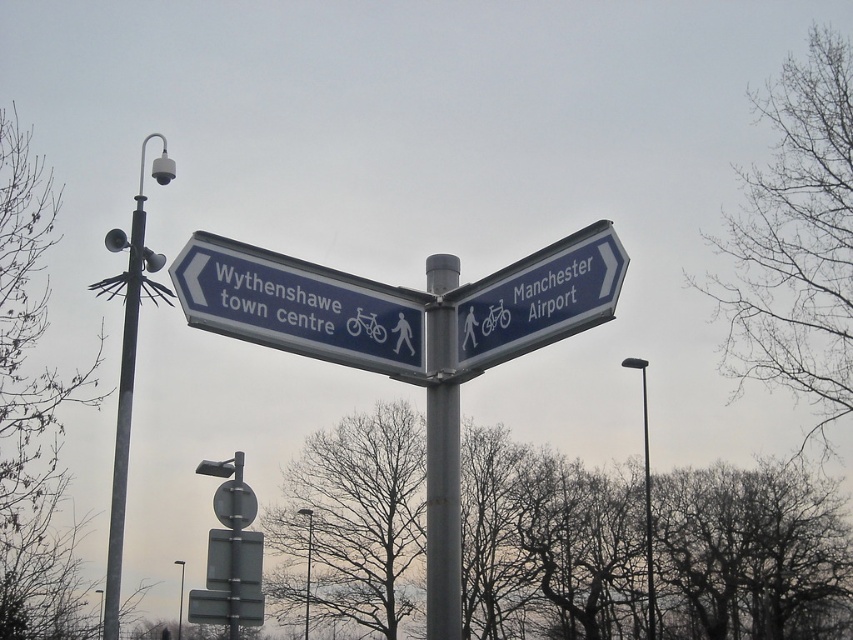
Question: Among these objects, which one is farthest from the camera?

Choices:
 (A) bare branches at left
 (B) black metal pole at right
 (C) brushed metal lamp post at center
 (D) metallic pole at lower center

Answer: (D)

Question: Does metallic pole at center come behind brushed metal lamp post at center?

Choices:
 (A) yes
 (B) no

Answer: (B)

Question: Is blue plastic manchester airport sign at upper right below black metal pole at right?

Choices:
 (A) yes
 (B) no

Answer: (B)

Question: Which point is closer to the camera?

Choices:
 (A) (183, 595)
 (B) (120, 516)
 (C) (229, 317)
 (D) (306, 554)

Answer: (C)

Question: In this image, where is metallic pole at center located relative to metallic pole at lower center?

Choices:
 (A) right
 (B) left

Answer: (A)

Question: Among these points, which one is nearest to the camera?

Choices:
 (A) (646, 458)
 (B) (445, 541)
 (C) (785, 282)
 (D) (328, 348)

Answer: (D)